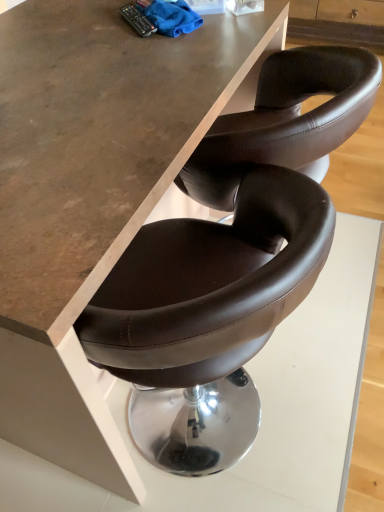
Find the location of a particular element. matte brown leather table at center is located at coordinates (94, 193).

The width and height of the screenshot is (384, 512). What do you see at coordinates (94, 193) in the screenshot?
I see `matte brown leather table at center` at bounding box center [94, 193].

This screenshot has height=512, width=384. Describe the element at coordinates (172, 17) in the screenshot. I see `blue microfiber cloth at upper center` at that location.

The width and height of the screenshot is (384, 512). Find the location of `blue microfiber cloth at upper center`. blue microfiber cloth at upper center is located at coordinates (172, 17).

At what (x,y) coordinates should I click in order to perform the action: click on matte brown leather table at center. Please return your answer as a coordinate pair (x, y). This screenshot has width=384, height=512. Looking at the image, I should click on (94, 193).

Considering the relative positions of blue microfiber cloth at upper center and matte brown leather table at center in the image provided, is blue microfiber cloth at upper center to the left or to the right of matte brown leather table at center?

In the image, blue microfiber cloth at upper center appears on the right side of matte brown leather table at center.

Does blue microfiber cloth at upper center lie in front of matte brown leather table at center?

No, blue microfiber cloth at upper center is further to the viewer.

Which is closer, (x=181, y=5) or (x=167, y=79)?

Point (x=181, y=5) is farther from the camera than point (x=167, y=79).

From the image's perspective, is blue microfiber cloth at upper center beneath matte brown leather table at center?

Actually, blue microfiber cloth at upper center appears above matte brown leather table at center in the image.

From a real-world perspective, between blue microfiber cloth at upper center and matte brown leather table at center, who is vertically higher?

blue microfiber cloth at upper center, from a real-world perspective.

Which of these two, blue microfiber cloth at upper center or matte brown leather table at center, is wider?

With larger width is matte brown leather table at center.

Does blue microfiber cloth at upper center have a greater height compared to matte brown leather table at center?

In fact, blue microfiber cloth at upper center may be shorter than matte brown leather table at center.

Does blue microfiber cloth at upper center have a smaller size compared to matte brown leather table at center?

Yes.

Is blue microfiber cloth at upper center spatially inside matte brown leather table at center, or outside of it?

blue microfiber cloth at upper center is spatially situated outside matte brown leather table at center.

Would you consider blue microfiber cloth at upper center to be distant from matte brown leather table at center?

blue microfiber cloth at upper center is actually quite close to matte brown leather table at center.

Is blue microfiber cloth at upper center aimed at matte brown leather table at center?

No, blue microfiber cloth at upper center does not turn towards matte brown leather table at center.

The image size is (384, 512). Find the location of `table lying in front of the blue microfiber cloth at upper center`. table lying in front of the blue microfiber cloth at upper center is located at coordinates (94, 193).

Would you say matte brown leather table at center is to the left or to the right of blue microfiber cloth at upper center in the picture?

From the image, it's evident that matte brown leather table at center is to the left of blue microfiber cloth at upper center.

Is matte brown leather table at center closer to the viewer compared to blue microfiber cloth at upper center?

Yes, the depth of matte brown leather table at center is less than that of blue microfiber cloth at upper center.

Considering the positions of point (1, 374) and point (159, 31), is point (1, 374) closer or farther from the camera than point (159, 31)?

Point (1, 374) is positioned closer to the camera compared to point (159, 31).

From the image's perspective, is matte brown leather table at center over blue microfiber cloth at upper center?

Actually, matte brown leather table at center appears below blue microfiber cloth at upper center in the image.

From a real-world perspective, between matte brown leather table at center and blue microfiber cloth at upper center, who is vertically higher?

From a 3D spatial view, blue microfiber cloth at upper center is above.

Considering the sizes of objects matte brown leather table at center and blue microfiber cloth at upper center in the image provided, who is wider, matte brown leather table at center or blue microfiber cloth at upper center?

With larger width is matte brown leather table at center.

Does matte brown leather table at center have a lesser height compared to blue microfiber cloth at upper center?

No.

Is matte brown leather table at center smaller than blue microfiber cloth at upper center?

Actually, matte brown leather table at center might be larger than blue microfiber cloth at upper center.

Is matte brown leather table at center completely or partially outside of blue microfiber cloth at upper center?

Yes, matte brown leather table at center is located beyond the bounds of blue microfiber cloth at upper center.

Is matte brown leather table at center not near blue microfiber cloth at upper center?

No.

Could you tell me if matte brown leather table at center is facing blue microfiber cloth at upper center?

No.

The image size is (384, 512). Find the location of `material that appears above the matte brown leather table at center (from a real-world perspective)`. material that appears above the matte brown leather table at center (from a real-world perspective) is located at coordinates [x=172, y=17].

This screenshot has height=512, width=384. In order to click on material on the right of matte brown leather table at center in this screenshot , I will do (x=172, y=17).

Where is `table below the blue microfiber cloth at upper center (from a real-world perspective)`? Image resolution: width=384 pixels, height=512 pixels. table below the blue microfiber cloth at upper center (from a real-world perspective) is located at coordinates (94, 193).